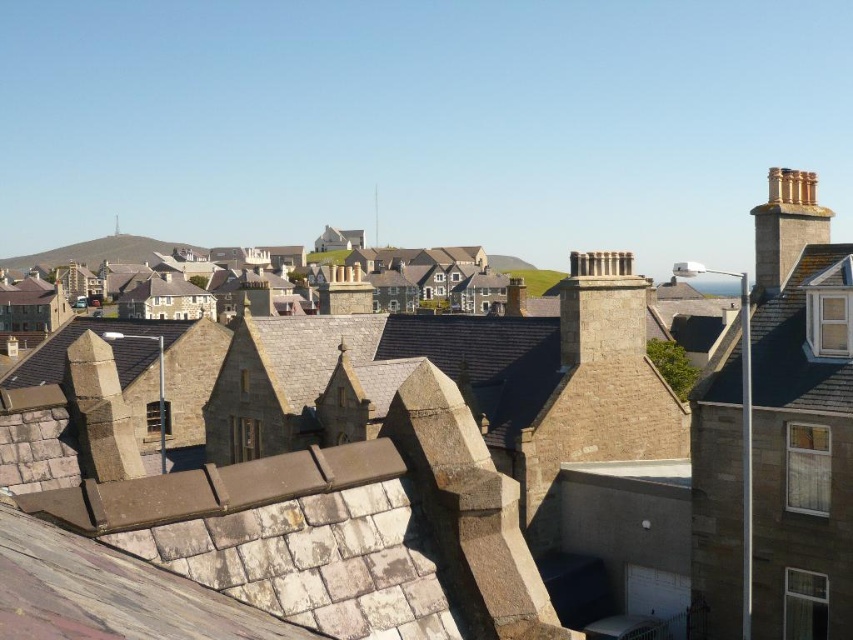
Question: Which of the following is the closest to the observer?

Choices:
 (A) brown stone roof at upper right
 (B) brown stone rooftops at center

Answer: (B)

Question: In this image, where is brown stone rooftops at center located relative to brown stone roof at upper right?

Choices:
 (A) below
 (B) above

Answer: (A)

Question: Which of the following is the closest to the observer?

Choices:
 (A) brown stone rooftops at center
 (B) golden stone chimney at upper right
 (C) brown stone roof at upper right

Answer: (A)

Question: Is brown stone roof at upper right closer to the viewer compared to golden stone chimney at upper right?

Choices:
 (A) yes
 (B) no

Answer: (A)

Question: Is the position of brown stone rooftops at center less distant than that of brown stone roof at upper right?

Choices:
 (A) yes
 (B) no

Answer: (A)

Question: Based on their relative distances, which object is nearer to the brown stone roof at upper right?

Choices:
 (A) brown stone rooftops at center
 (B) golden stone chimney at upper right

Answer: (B)